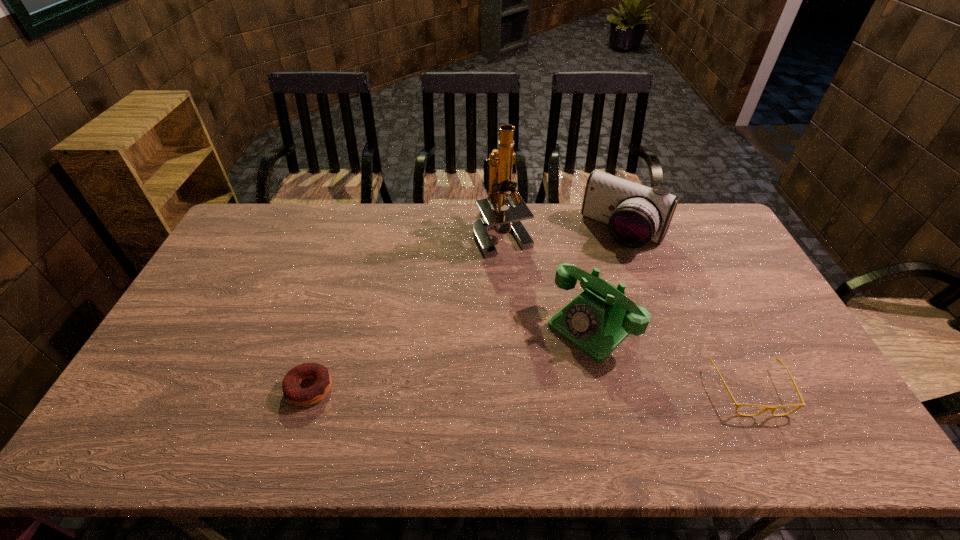
This screenshot has height=540, width=960. In order to click on doughnut in this screenshot , I will do `click(293, 393)`.

You are a GUI agent. You are given a task and a screenshot of the screen. Output one action in this format:
    pyautogui.click(x=<x>, y=<y>)
    Task: Click on the spectacles
    Image resolution: width=960 pixels, height=540 pixels.
    Given the screenshot: What is the action you would take?
    pyautogui.click(x=772, y=408)

Locate an element on the screen. the second object from left to right is located at coordinates (498, 167).

At what (x,y) coordinates should I click in order to perform the action: click on the tallest object. Please return your answer as a coordinate pair (x, y). The width and height of the screenshot is (960, 540). Looking at the image, I should click on (498, 167).

The height and width of the screenshot is (540, 960). What are the coordinates of `camcorder` in the screenshot? It's located at (635, 214).

The width and height of the screenshot is (960, 540). I want to click on telephone, so click(x=596, y=321).

Locate an element on the screen. This screenshot has height=540, width=960. vacant space located on the right of the doughnut is located at coordinates (398, 388).

The image size is (960, 540). I want to click on free space located at the eyepiece of the microscope, so click(496, 310).

This screenshot has height=540, width=960. Find the location of `free space located 0.290m at the eyepiece of the microscope`. free space located 0.290m at the eyepiece of the microscope is located at coordinates (494, 326).

The image size is (960, 540). In order to click on vacant space situated at the eyepiece of the microscope in this screenshot , I will do `click(497, 298)`.